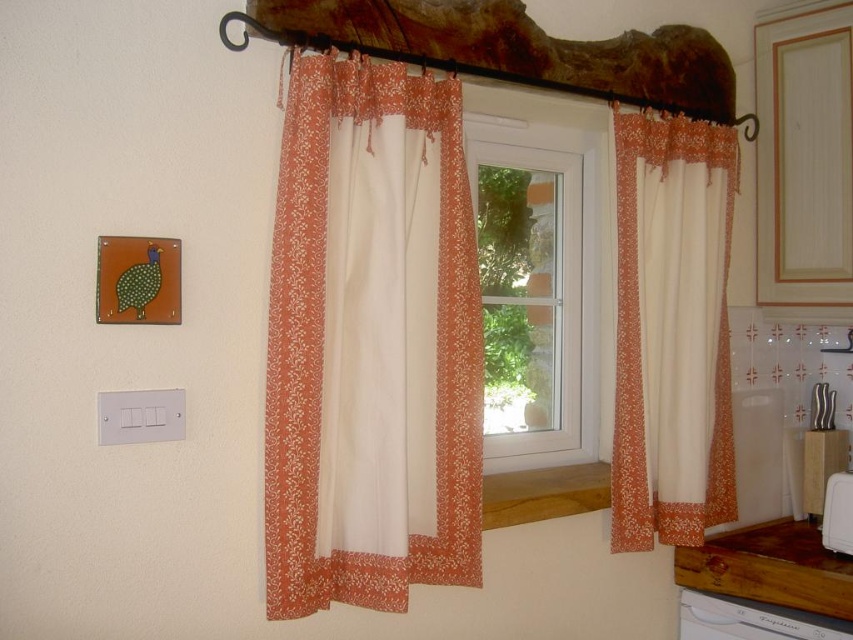
You are arranging items in the kitchen and need to determine which object is taller between the floral lace curtain at right and the white plastic dishwasher at lower right. Based on the scene, which one is taller?

The floral lace curtain at right is taller than the white plastic dishwasher at lower right.

In the scene shown: You are trying to decide whether to place a large painting that requires a frame of 1 meter in width. You see the transparent glass window at center and the white plastic dishwasher at lower right. Which object can accommodate the frame width if the painting must be placed adjacent to one of them?

The transparent glass window at center is bigger than the white plastic dishwasher at lower right, so the transparent glass window at center can accommodate the frame width of 1 meter.